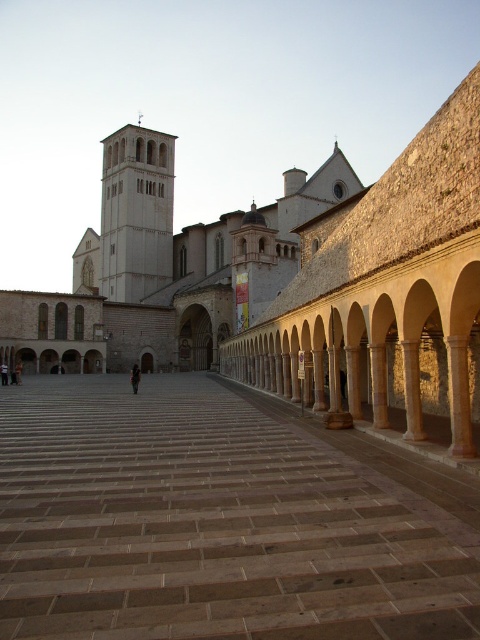
Question: Which point is farther to the camera?

Choices:
 (A) white stone tower at center
 (B) brown stone courtyard at center

Answer: (A)

Question: From the image, what is the correct spatial relationship of brown stone courtyard at center in relation to white stone tower at center?

Choices:
 (A) left
 (B) right

Answer: (B)

Question: Is brown stone courtyard at center wider than white stone tower at center?

Choices:
 (A) yes
 (B) no

Answer: (A)

Question: Can you confirm if brown stone courtyard at center is positioned below white stone tower at center?

Choices:
 (A) yes
 (B) no

Answer: (A)